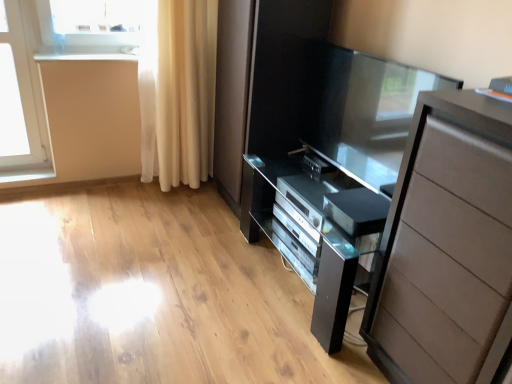
Identify the location of blank space situated above white glossy window sill at upper left (from a real-world perspective). (93, 53).